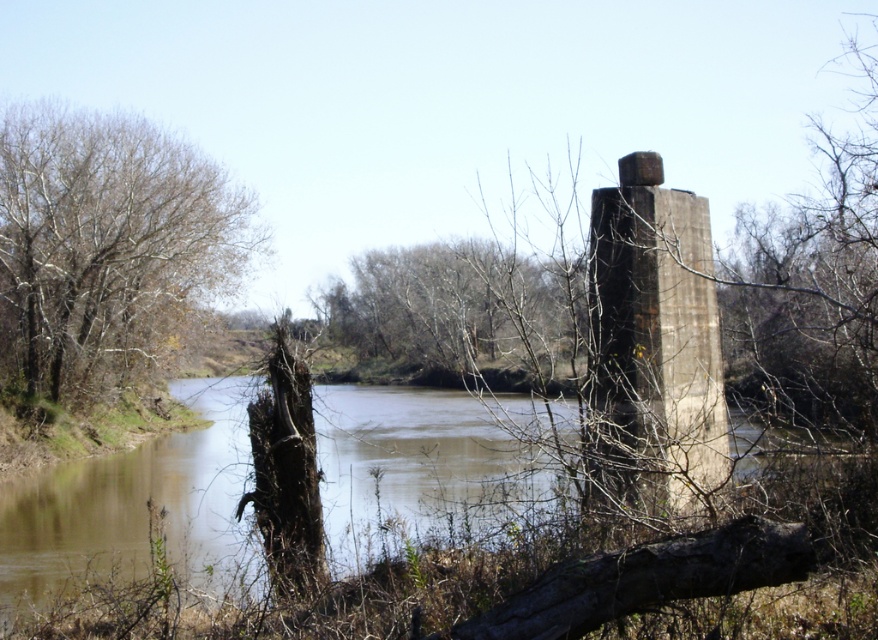
From the picture: You are a kayaker planning to navigate through the riverside scene. You see the brown muddy water at center and the bare wood tree at center. Which path should you choose to ensure your kayak has enough space to pass safely?

The brown muddy water at center is wider than the bare wood tree at center, so choosing the path through the brown muddy water at center would provide more space for the kayak to pass safely.

What are the coordinates of the brown leafless tree at left in the image?

The brown leafless tree at left is located at coordinates point (x=106, y=248).